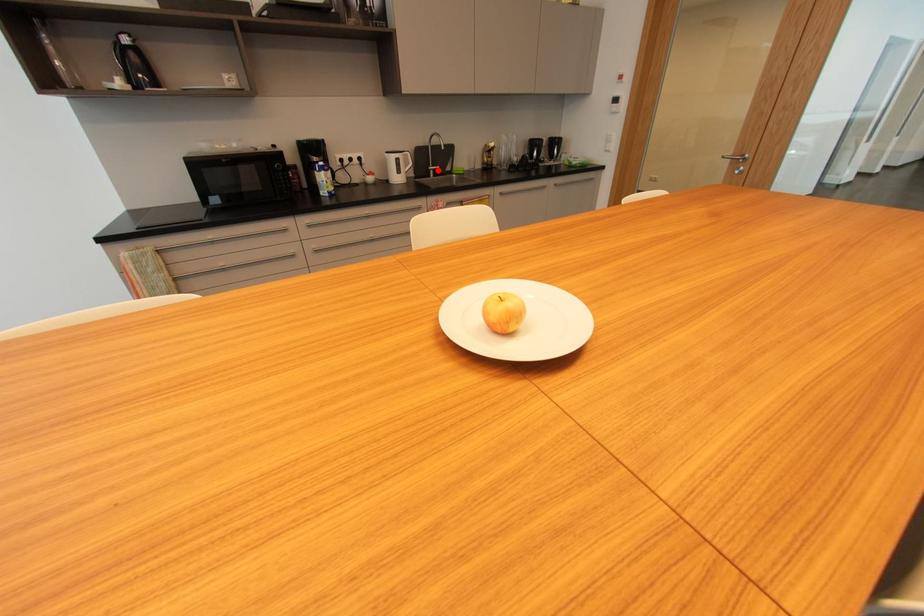
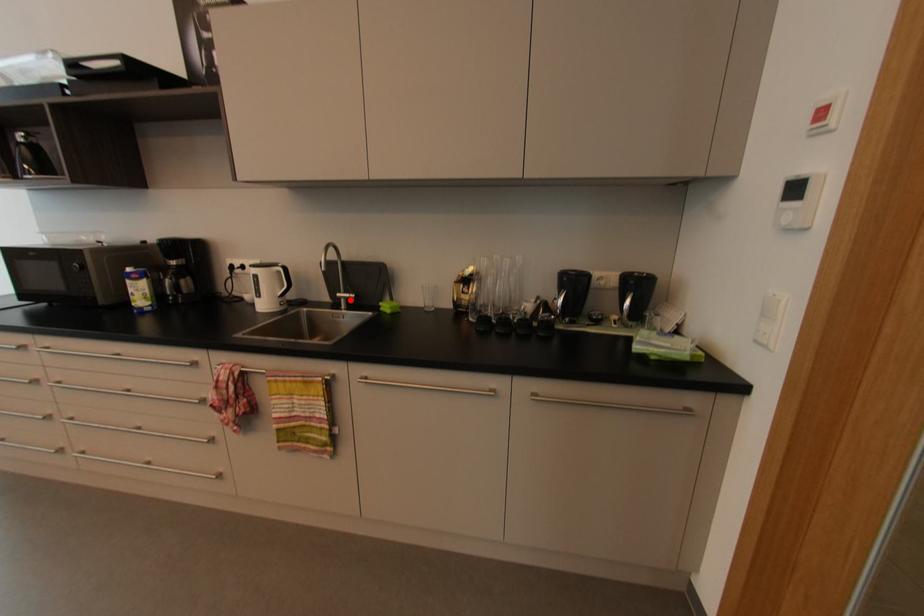
I am providing you with two images of the same scene from different viewpoints. A red point is marked on the first image and another point is marked on the second image. Do the highlighted points in image1 and image2 indicate the same real-world spot?

Yes